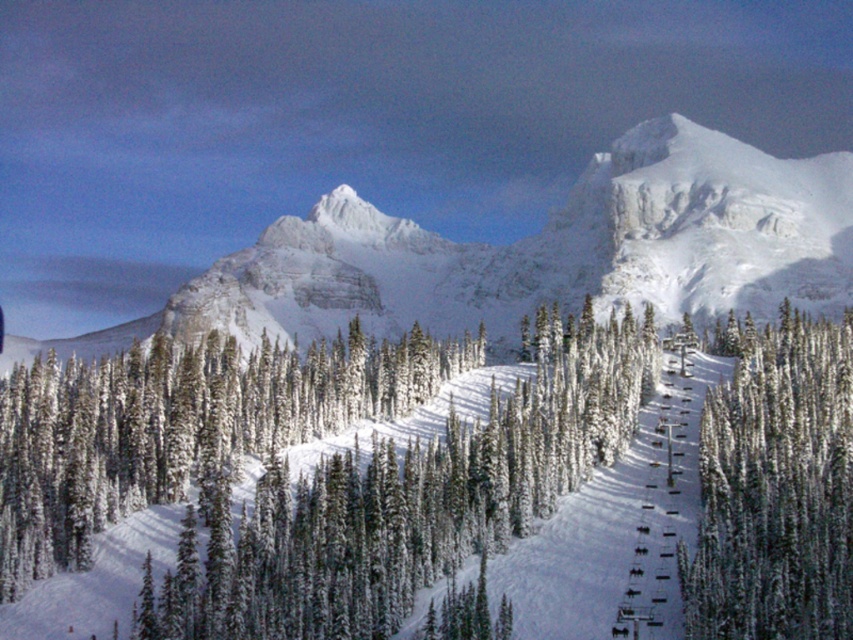
Can you confirm if white snow-covered mountain at center is shorter than green snow-covered trees at center-right?

In fact, white snow-covered mountain at center may be taller than green snow-covered trees at center-right.

This screenshot has height=640, width=853. Find the location of `white snow-covered mountain at center`. white snow-covered mountain at center is located at coordinates (537, 252).

Is point (726, 168) in front of point (843, 589)?

No, (726, 168) is further to viewer.

At what (x,y) coordinates should I click in order to perform the action: click on white snow-covered mountain at center. Please return your answer as a coordinate pair (x, y). This screenshot has height=640, width=853. Looking at the image, I should click on (537, 252).